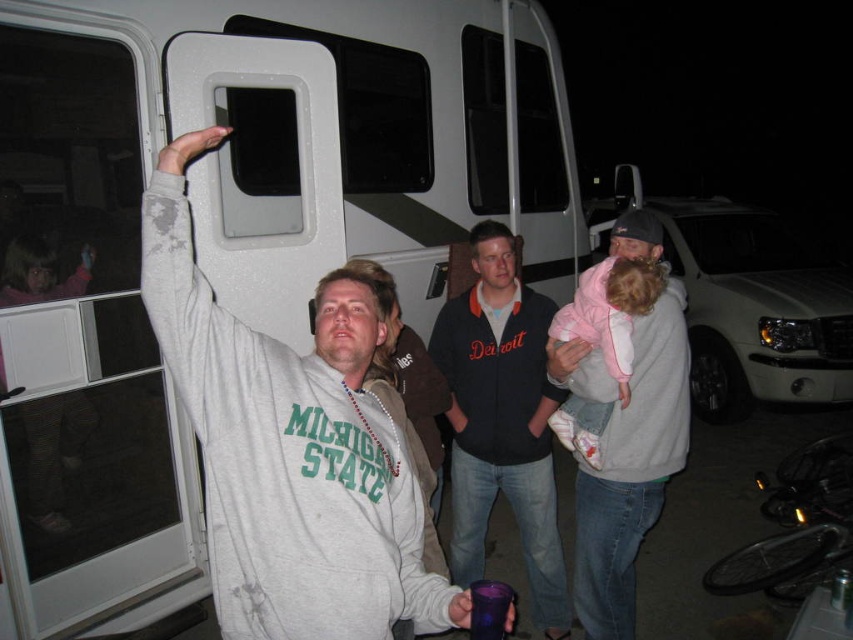
You are standing in the dark area of the scene and want to move towards the lighted area. Which object should you walk towards, the white plastic recreational vehicle at center or the matte pink hoodie at upper left?

The white plastic recreational vehicle at center is taller than the matte pink hoodie at upper left, so it would likely cast a larger shadow. Therefore, you should walk towards the matte pink hoodie at upper left to reach the lighted area.

You are at a nighttime gathering near an RV. You see the white plastic recreational vehicle at center and the matte pink hoodie at upper left. Which object is positioned to the right of the other?

The white plastic recreational vehicle at center is to the right of the matte pink hoodie at upper left.